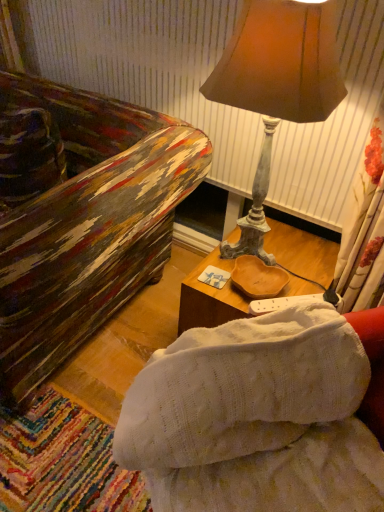
Question: Is point (322, 108) positioned closer to the camera than point (226, 343)?

Choices:
 (A) farther
 (B) closer

Answer: (A)

Question: Would you say matte brown lampshade at upper right is to the left or to the right of white knitted studio couch at center in the picture?

Choices:
 (A) right
 (B) left

Answer: (A)

Question: Which object is positioned closest to the matte brown lampshade at upper right?

Choices:
 (A) white knitted studio couch at center
 (B) wooden tray at center

Answer: (B)

Question: Which is farther from the wooden tray at center?

Choices:
 (A) white knitted studio couch at center
 (B) matte brown lampshade at upper right

Answer: (B)